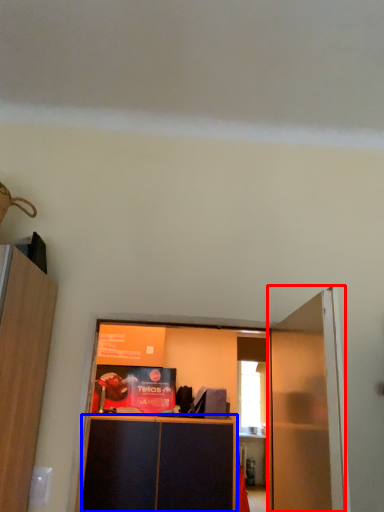
Question: Which object is closer to the camera taking this photo, door (highlighted by a red box) or cabinetry (highlighted by a blue box)?

Choices:
 (A) door
 (B) cabinetry

Answer: (A)